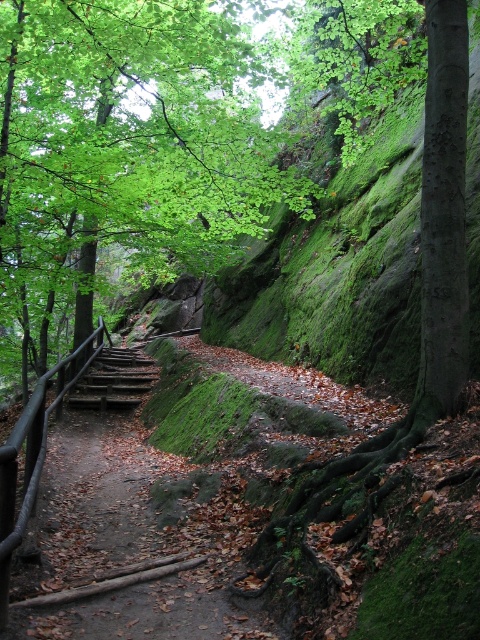
You are a hiker walking along the dirt path at center. You notice a green leafy tree at center blocking your view ahead. Can you see the mossy rock face ahead on the right side of the path? Explain why or why not.

The dirt path at center is behind green leafy tree at center, so the tree is in front of the path. This means the tree would block your view of the mossy rock face ahead on the right side of the path.